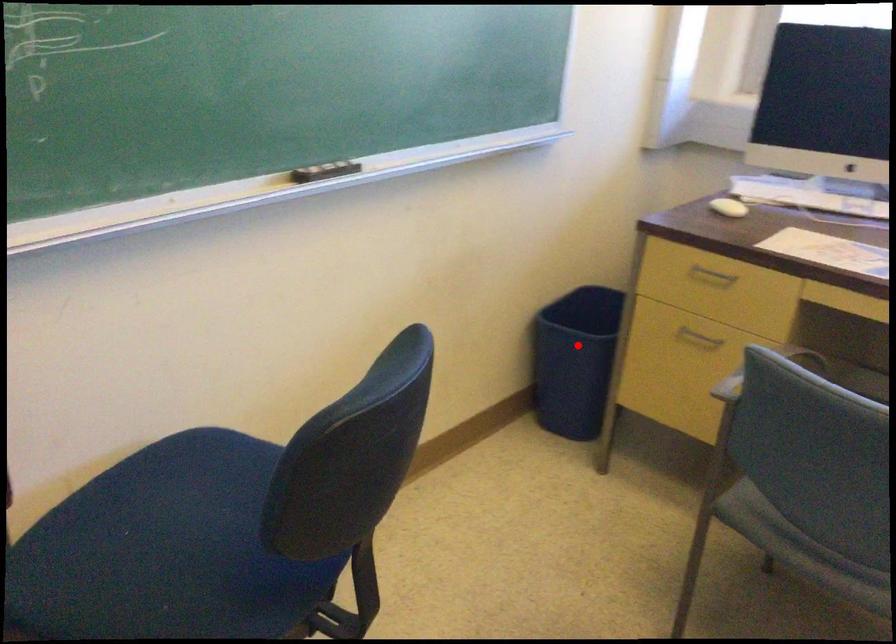
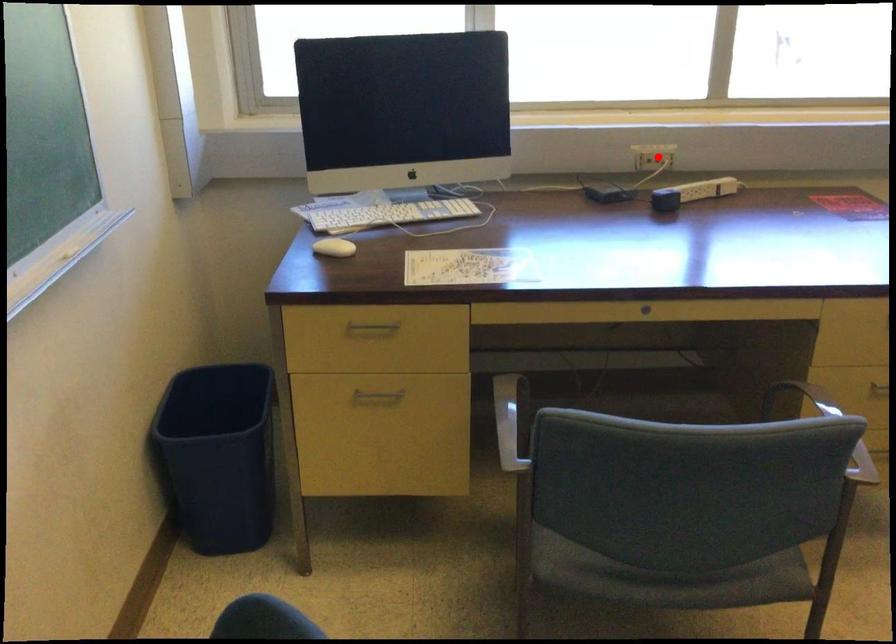
I am providing you with two images of the same scene from different viewpoints. A red point is marked on the first image and another point is marked on the second image. Is the red point in image1 aligned with the point shown in image2?

No